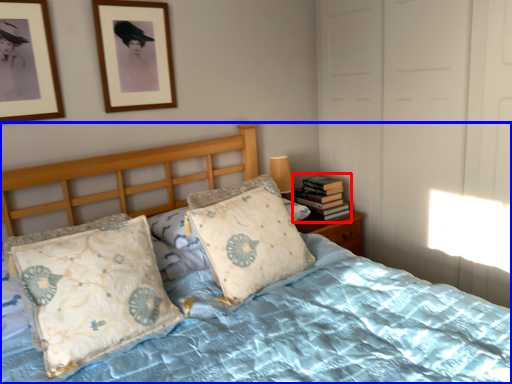
Question: Which object is further to the camera taking this photo, book (highlighted by a red box) or bed (highlighted by a blue box)?

Choices:
 (A) book
 (B) bed

Answer: (A)